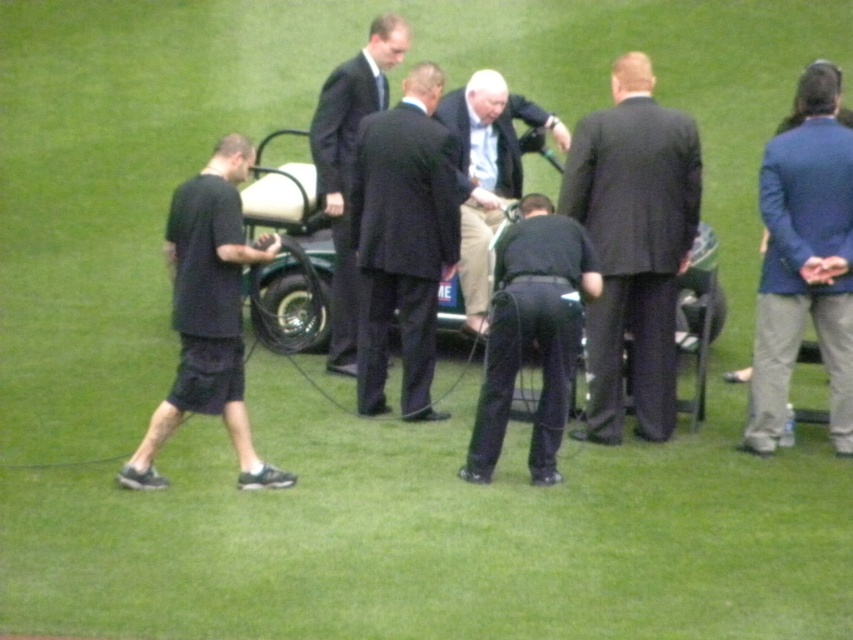
Question: Which point is farther to the camera?

Choices:
 (A) (225, 182)
 (B) (689, 176)
 (C) (390, 244)

Answer: (C)

Question: Which object appears closest to the camera in this image?

Choices:
 (A) blue woolen blazer at right
 (B) dark suit at center
 (C) black suit at center
 (D) light blue shirt at center

Answer: (A)

Question: Can you confirm if black suit at center is positioned below light blue shirt at center?

Choices:
 (A) no
 (B) yes

Answer: (B)

Question: From the image, what is the correct spatial relationship of black matte shorts at left in relation to dark blue suit at center?

Choices:
 (A) above
 (B) below

Answer: (B)

Question: Considering the real-world distances, which object is farthest from the black suit at center?

Choices:
 (A) dark blue suit at center
 (B) black matte camera at center

Answer: (B)

Question: Is black suit at center in front of dark blue suit at center?

Choices:
 (A) yes
 (B) no

Answer: (A)